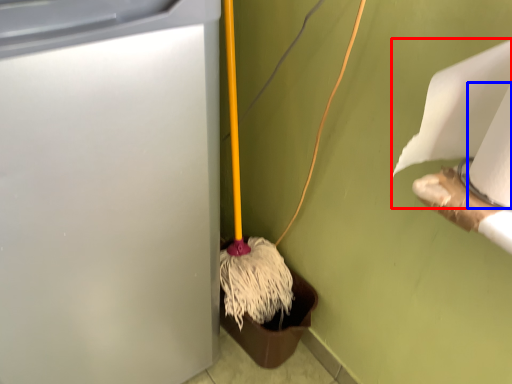
Question: Which point is closer to the camera, toilet paper (highlighted by a red box) or toilet paper (highlighted by a blue box)?

Choices:
 (A) toilet paper
 (B) toilet paper

Answer: (B)